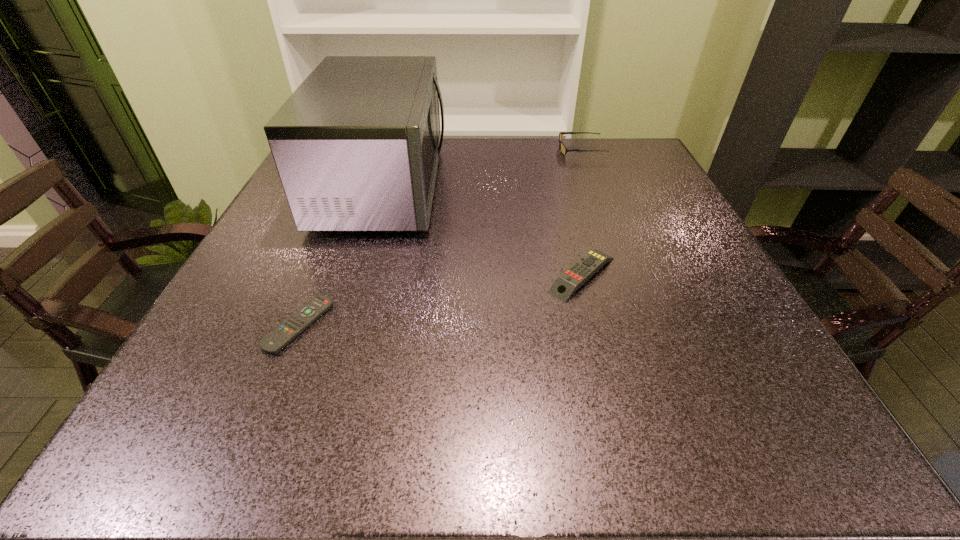
You are a GUI agent. You are given a task and a screenshot of the screen. Output one action in this format:
    pyautogui.click(x=<x>, y=<y>)
    Task: Click on the free region at the left edge of the desktop
    The height and width of the screenshot is (540, 960).
    Given the screenshot: What is the action you would take?
    pyautogui.click(x=289, y=301)

You are a GUI agent. You are given a task and a screenshot of the screen. Output one action in this format:
    pyautogui.click(x=<x>, y=<y>)
    Task: Click on the free space at the right edge of the desktop
    
    Given the screenshot: What is the action you would take?
    pyautogui.click(x=660, y=237)

Locate an element on the screen. The image size is (960, 540). vacant region at the far right corner is located at coordinates (652, 165).

Identify the location of free space at the near right corner. point(740,396).

Where is `free spot between the shorter remote control and the second tallest object`? free spot between the shorter remote control and the second tallest object is located at coordinates (440, 237).

This screenshot has width=960, height=540. Identify the location of vacant area that lies between the taller remote control and the third shortest object. (581, 212).

Identify the location of free space that is in between the sunglasses and the microwave oven. This screenshot has height=540, width=960. (481, 168).

At what (x,y) coordinates should I click in order to perform the action: click on free space that is in between the taller remote control and the tallest object. Please return your answer as a coordinate pair (x, y). Looking at the image, I should click on (482, 231).

Where is `free space between the sunglasses and the left remote control`? The height and width of the screenshot is (540, 960). free space between the sunglasses and the left remote control is located at coordinates (440, 237).

Where is `unoccupied position between the right remote control and the tallest object`? unoccupied position between the right remote control and the tallest object is located at coordinates (482, 231).